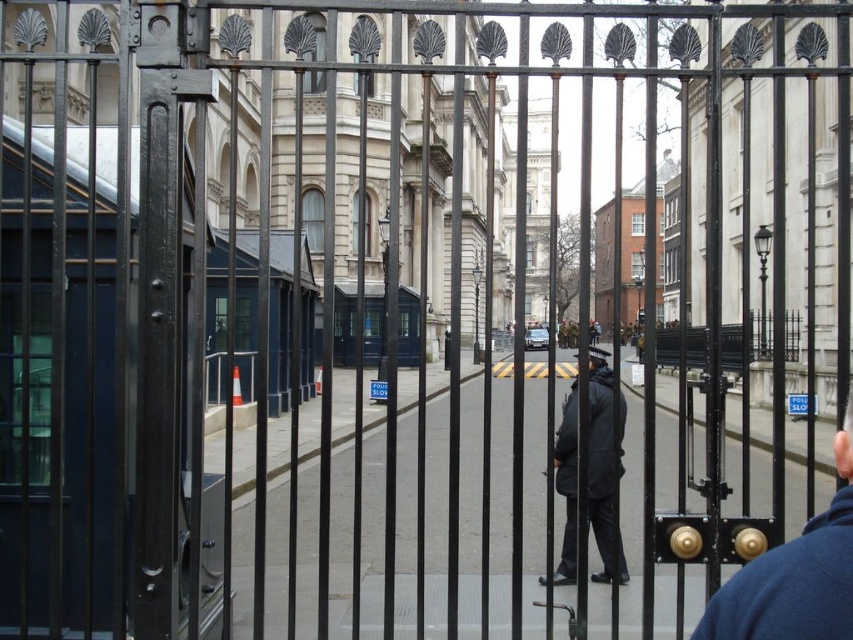
Which is behind, point (793, 577) or point (563, 563)?

Positioned behind is point (563, 563).

Can you confirm if blue fleece jacket at right is smaller than dark gray fabric jacket at center?

Correct, blue fleece jacket at right occupies less space than dark gray fabric jacket at center.

Measure the distance between blue fleece jacket at right and camera.

The distance of blue fleece jacket at right from camera is 6.31 meters.

Locate an element on the screen. Image resolution: width=853 pixels, height=640 pixels. blue fleece jacket at right is located at coordinates (795, 576).